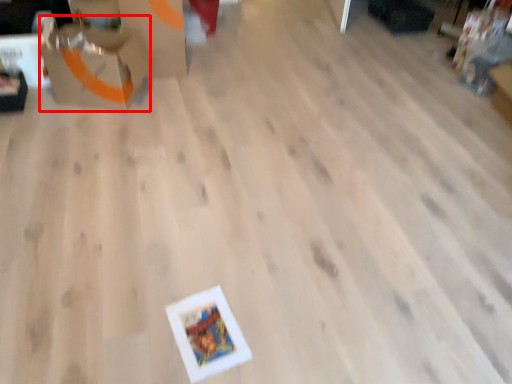
Question: From the image, what is the correct spatial relationship of cardboard box (annotated by the red box) in relation to cardboard box?

Choices:
 (A) right
 (B) left

Answer: (B)